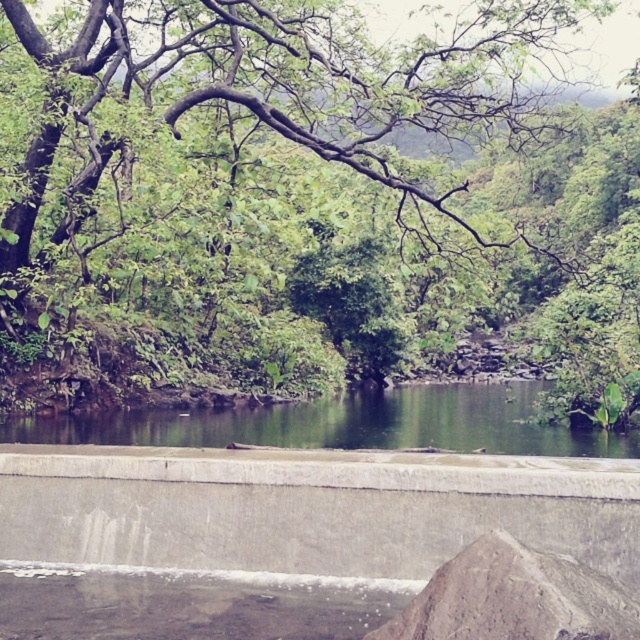
Question: Does gray concrete at center have a smaller size compared to green smooth water at center?

Choices:
 (A) no
 (B) yes

Answer: (B)

Question: Which point appears closest to the camera in this image?

Choices:
 (A) (465, 33)
 (B) (490, 506)
 (C) (461, 444)

Answer: (B)

Question: Which of the following is the closest to the observer?

Choices:
 (A) (532, 120)
 (B) (250, 412)
 (C) (552, 502)

Answer: (C)

Question: Can you confirm if gray concrete at center is positioned to the right of green smooth water at center?

Choices:
 (A) no
 (B) yes

Answer: (A)

Question: Which point is closer to the camera?

Choices:
 (A) green smooth water at center
 (B) gray concrete at center

Answer: (B)

Question: Is gray concrete at center to the left of green smooth water at center from the viewer's perspective?

Choices:
 (A) no
 (B) yes

Answer: (B)